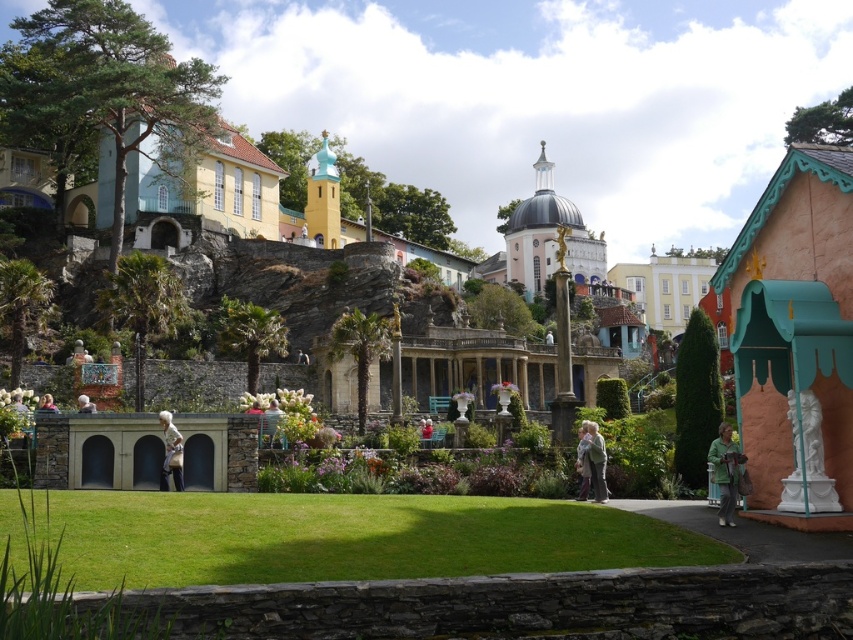
Question: Which point is farther to the camera?

Choices:
 (A) (41, 404)
 (B) (577, 460)
 (C) (119, 509)

Answer: (A)

Question: Does green grass at lower center have a greater width compared to matte gray jacket at lower right?

Choices:
 (A) no
 (B) yes

Answer: (B)

Question: Observing the image, what is the correct spatial positioning of matte gray jacket at lower right in reference to white fabric dress at center?

Choices:
 (A) below
 (B) above

Answer: (A)

Question: Can you confirm if green grass at lower center is positioned above white fabric dress at center?

Choices:
 (A) no
 (B) yes

Answer: (A)

Question: Which is nearer to the green grass at lower center?

Choices:
 (A) matte gray jacket at lower right
 (B) white fabric dress at center

Answer: (B)

Question: Among these objects, which one is farthest from the camera?

Choices:
 (A) green textured coat at center
 (B) white fabric bag at center
 (C) light brown hair at lower left

Answer: (B)